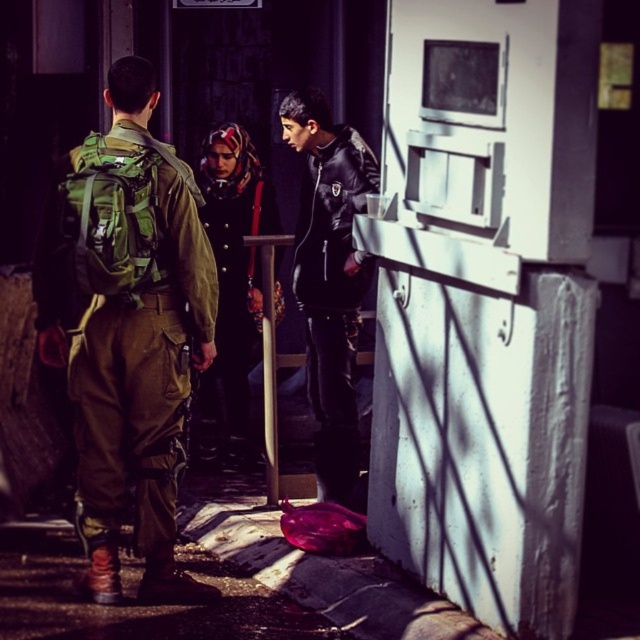
Who is taller, green military uniform at left or matte black jacket at center?

green military uniform at left is taller.

Where is `green military uniform at left`? The width and height of the screenshot is (640, 640). green military uniform at left is located at coordinates (128, 330).

Where is `green military uniform at left`? green military uniform at left is located at coordinates (128, 330).

Who is shorter, black leather jacket at center or matte black jacket at center?

black leather jacket at center

Is black leather jacket at center to the left of matte black jacket at center from the viewer's perspective?

Incorrect, black leather jacket at center is not on the left side of matte black jacket at center.

Between point (355, 204) and point (241, 284), which one is positioned in front?

Point (355, 204) is in front.

Locate an element on the screen. black leather jacket at center is located at coordinates (330, 276).

Who is more distant from viewer, (x=140, y=250) or (x=324, y=104)?

The point (x=324, y=104) is more distant.

Looking at this image, between green military uniform at left and black leather jacket at center, which one is positioned higher?

black leather jacket at center is above.

Describe the element at coordinates (128, 330) in the screenshot. This screenshot has width=640, height=640. I see `green military uniform at left` at that location.

The image size is (640, 640). In order to click on green military uniform at left in this screenshot , I will do `click(128, 330)`.